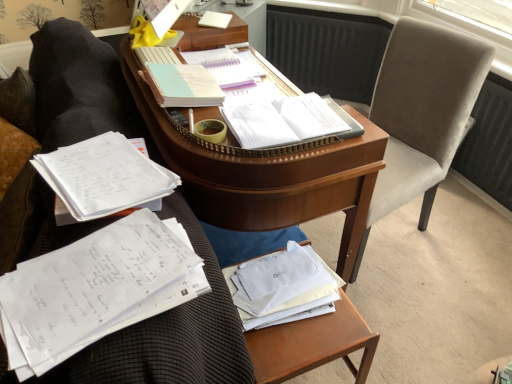
Question: Is wooden at lower right a part of light blue paper at center, which ranks as the first book in back-to-front order?

Choices:
 (A) yes
 (B) no

Answer: (B)

Question: Considering the relative sizes of light blue paper at center, which ranks as the first book in back-to-front order, and wooden at lower right in the image provided, is light blue paper at center, which ranks as the first book in back-to-front order, taller than wooden at lower right?

Choices:
 (A) no
 (B) yes

Answer: (A)

Question: Is light blue paper at center, which ranks as the first book in back-to-front order, oriented away from wooden at lower right?

Choices:
 (A) yes
 (B) no

Answer: (B)

Question: Is light blue paper at center, which ranks as the first book in back-to-front order, aimed at wooden at lower right?

Choices:
 (A) no
 (B) yes

Answer: (A)

Question: Can you confirm if light blue paper at center, the fourth book from the front, is wider than wooden at lower right?

Choices:
 (A) no
 (B) yes

Answer: (A)

Question: From the image's perspective, relative to white paper at center, arranged as the 3th book when viewed from the back, is light blue spiral notebook at center, which is the second book from back to front, above or below?

Choices:
 (A) above
 (B) below

Answer: (A)

Question: In terms of width, does light blue spiral notebook at center, the third book positioned from the front, look wider or thinner when compared to white paper at center, arranged as the 3th book when viewed from the back?

Choices:
 (A) thin
 (B) wide

Answer: (A)

Question: Considering their positions, is light blue spiral notebook at center, which is the second book from back to front, located in front of or behind white paper at center, which is counted as the second book, starting from the front?

Choices:
 (A) front
 (B) behind

Answer: (B)

Question: Considering the positions of light blue spiral notebook at center, which is the second book from back to front, and white paper at center, which is counted as the second book, starting from the front, in the image, is light blue spiral notebook at center, which is the second book from back to front, taller or shorter than white paper at center, which is counted as the second book, starting from the front,?

Choices:
 (A) tall
 (B) short

Answer: (A)

Question: Is light blue spiral notebook at center, which is the second book from back to front, taller or shorter than velvet gray swivel chair at right?

Choices:
 (A) tall
 (B) short

Answer: (B)

Question: Considering the relative positions of light blue spiral notebook at center, the third book positioned from the front, and velvet gray swivel chair at right in the image provided, is light blue spiral notebook at center, the third book positioned from the front, to the left or to the right of velvet gray swivel chair at right?

Choices:
 (A) left
 (B) right

Answer: (A)

Question: Considering the positions of light blue spiral notebook at center, the third book positioned from the front, and velvet gray swivel chair at right in the image, is light blue spiral notebook at center, the third book positioned from the front, bigger or smaller than velvet gray swivel chair at right?

Choices:
 (A) big
 (B) small

Answer: (B)

Question: From the image's perspective, is light blue spiral notebook at center, which is the second book from back to front, located above or below velvet gray swivel chair at right?

Choices:
 (A) above
 (B) below

Answer: (A)

Question: Is wooden desk at center inside the boundaries of wooden at lower right, or outside?

Choices:
 (A) outside
 (B) inside

Answer: (A)

Question: Considering their positions, is wooden desk at center located in front of or behind wooden at lower right?

Choices:
 (A) behind
 (B) front

Answer: (B)